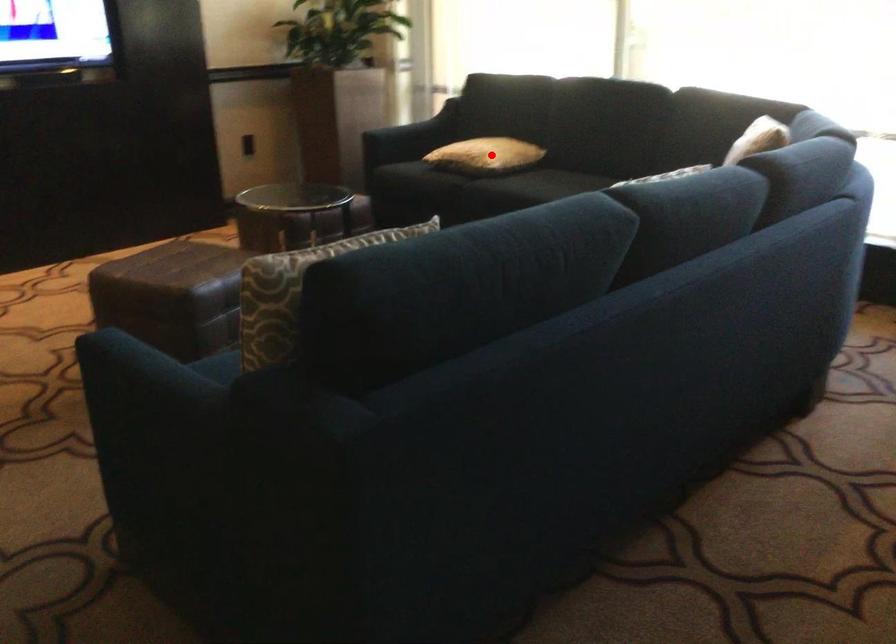
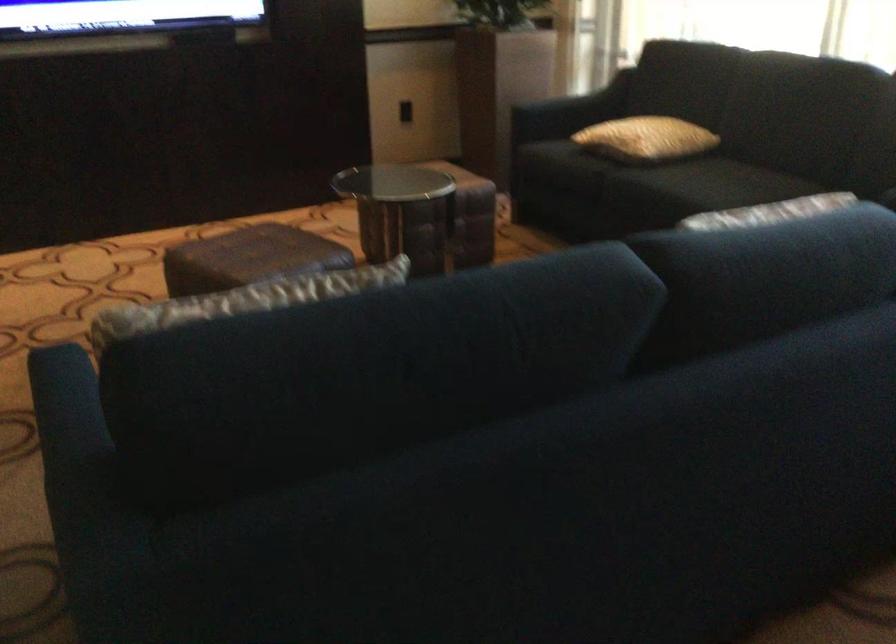
Question: I am providing you with two images of the same scene from different viewpoints. A red point is shown in image1. For the corresponding object point in image2, is it positioned nearer or farther from the camera?

Choices:
 (A) Nearer
 (B) Farther

Answer: (A)